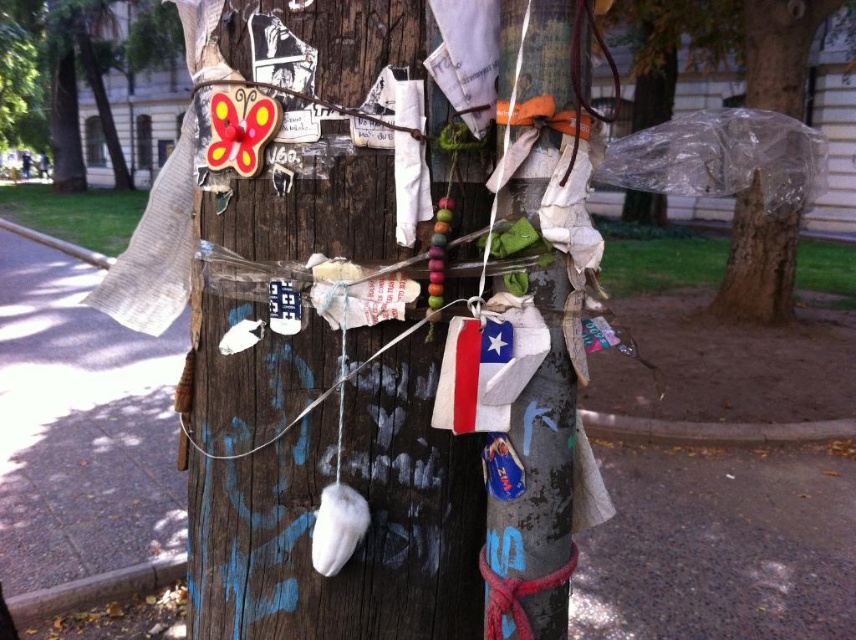
You are a photographer trying to capture the wooden butterfly at upper left in your shot. Based on its position, where should you aim your camera to ensure it is centered in the frame?

The wooden butterfly at upper left is located at coordinates approximately 0.114 on the x and 0.085 on the y axis. To center it in the frame, aim your camera so the butterfly aligns with the center point of your viewfinder.